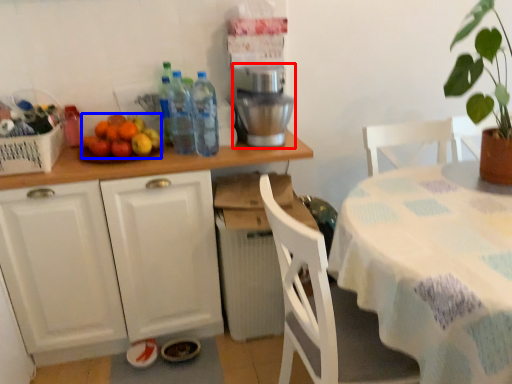
Question: Which object is further to the camera taking this photo, coffee machine (highlighted by a red box) or fruit (highlighted by a blue box)?

Choices:
 (A) coffee machine
 (B) fruit

Answer: (A)